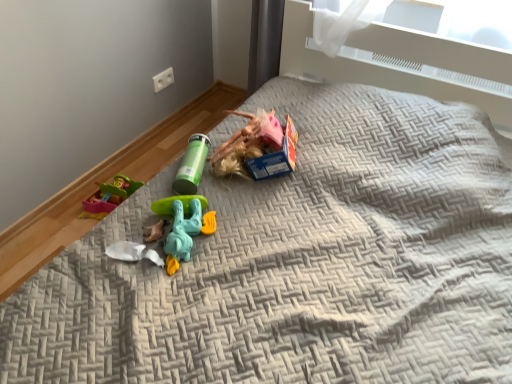
What is the approximate width of white plastic toy at center, acting as the second toy starting from the front?

2.19 inches.

This screenshot has width=512, height=384. Describe the element at coordinates (133, 252) in the screenshot. I see `white plastic toy at center, positioned as the 1th toy in bottom-to-top order` at that location.

Image resolution: width=512 pixels, height=384 pixels. I want to click on green plastic tube at center, marked as the first toy in a back-to-front arrangement, so click(192, 165).

Identify the location of teal plastic toy at center, positioned as the 1th toy in front-to-back order. (183, 226).

This screenshot has height=384, width=512. I want to click on toy below the teal plastic toy at center, positioned as the 1th toy in front-to-back order (from a real-world perspective), so click(133, 252).

From the image's perspective, between white plastic toy at center, marked as the 3th toy in a top-to-bottom arrangement, and teal plastic toy at center, which is the second toy from bottom to top, which one is located above?

teal plastic toy at center, which is the second toy from bottom to top, appears higher in the image.

Looking at this image, from a real-world perspective, relative to teal plastic toy at center, which is the second toy from bottom to top, is white plastic toy at center, marked as the 3th toy in a top-to-bottom arrangement, vertically above or below?

A: white plastic toy at center, marked as the 3th toy in a top-to-bottom arrangement, is situated lower than teal plastic toy at center, which is the second toy from bottom to top, in the real world.

Is white plastic toy at center, positioned as the 1th toy in bottom-to-top order, directly adjacent to teal plastic toy at center, positioned as the 1th toy in front-to-back order?

white plastic toy at center, positioned as the 1th toy in bottom-to-top order, is not next to teal plastic toy at center, positioned as the 1th toy in front-to-back order, and they're not touching.

From the picture: How different are the orientations of teal plastic toy at center, positioned as the 2th toy in top-to-bottom order, and white plastic toy at center, the second toy in the back-to-front sequence, in degrees?

18 degrees.

Is teal plastic toy at center, positioned as the 2th toy in top-to-bottom order, oriented towards white plastic toy at center, positioned as the 1th toy in bottom-to-top order?

No, teal plastic toy at center, positioned as the 2th toy in top-to-bottom order, is not turned towards white plastic toy at center, positioned as the 1th toy in bottom-to-top order.

Is teal plastic toy at center, which ranks as the third toy in back-to-front order, to the right of white plastic toy at center, marked as the 3th toy in a top-to-bottom arrangement, from the viewer's perspective?

Correct, you'll find teal plastic toy at center, which ranks as the third toy in back-to-front order, to the right of white plastic toy at center, marked as the 3th toy in a top-to-bottom arrangement.

Is teal plastic toy at center, which ranks as the third toy in back-to-front order, directly adjacent to white plastic toy at center, acting as the second toy starting from the front?

No.

In terms of width, does green plastic tube at center, which is counted as the third toy, starting from the front, look wider or thinner when compared to teal plastic toy at center, positioned as the 2th toy in top-to-bottom order?

In the image, green plastic tube at center, which is counted as the third toy, starting from the front, appears to be more narrow than teal plastic toy at center, positioned as the 2th toy in top-to-bottom order.

At what (x,y) coordinates should I click in order to perform the action: click on toy above the teal plastic toy at center, which ranks as the third toy in back-to-front order (from the image's perspective). Please return your answer as a coordinate pair (x, y). This screenshot has width=512, height=384. Looking at the image, I should click on (192, 165).

Consider the image. Could you tell me if green plastic tube at center, marked as the first toy in a back-to-front arrangement, is facing teal plastic toy at center, which ranks as the third toy in back-to-front order?

Yes, green plastic tube at center, marked as the first toy in a back-to-front arrangement, is facing teal plastic toy at center, which ranks as the third toy in back-to-front order.

Is the position of white plastic toy at center, acting as the second toy starting from the front, less distant than that of green plastic tube at center, which is counted as the third toy, starting from the front?

Yes, white plastic toy at center, acting as the second toy starting from the front, is in front of green plastic tube at center, which is counted as the third toy, starting from the front.

Is white plastic toy at center, marked as the 3th toy in a top-to-bottom arrangement, oriented towards green plastic tube at center, marked as the first toy in a back-to-front arrangement?

No, white plastic toy at center, marked as the 3th toy in a top-to-bottom arrangement, does not turn towards green plastic tube at center, marked as the first toy in a back-to-front arrangement.

What's the angular difference between white plastic toy at center, acting as the second toy starting from the front, and green plastic tube at center, marked as the first toy in a back-to-front arrangement,'s facing directions?

white plastic toy at center, acting as the second toy starting from the front, and green plastic tube at center, marked as the first toy in a back-to-front arrangement, are facing 0.63 degrees away from each other.

Based on their sizes in the image, would you say white plastic toy at center, positioned as the 1th toy in bottom-to-top order, is bigger or smaller than green plastic tube at center, marked as the first toy in a back-to-front arrangement?

Considering their sizes, white plastic toy at center, positioned as the 1th toy in bottom-to-top order, takes up less space than green plastic tube at center, marked as the first toy in a back-to-front arrangement.

In terms of size, does teal plastic toy at center, which is the second toy from bottom to top, appear bigger or smaller than green plastic tube at center, which is counted as the third toy, starting from the front?

In the image, teal plastic toy at center, which is the second toy from bottom to top, appears to be larger than green plastic tube at center, which is counted as the third toy, starting from the front.

Considering the sizes of objects teal plastic toy at center, which ranks as the third toy in back-to-front order, and green plastic tube at center, which is the third toy in bottom-to-top order, in the image provided, who is taller, teal plastic toy at center, which ranks as the third toy in back-to-front order, or green plastic tube at center, which is the third toy in bottom-to-top order,?

green plastic tube at center, which is the third toy in bottom-to-top order.

From the image's perspective, is teal plastic toy at center, positioned as the 1th toy in front-to-back order, located above or below green plastic tube at center, which is the third toy in bottom-to-top order?

From the image's perspective, teal plastic toy at center, positioned as the 1th toy in front-to-back order, appears below green plastic tube at center, which is the third toy in bottom-to-top order.

From the image's perspective, relative to white plastic toy at center, the second toy in the back-to-front sequence, is green plastic tube at center, which is counted as the third toy, starting from the front, above or below?

From the image's perspective, green plastic tube at center, which is counted as the third toy, starting from the front, appears above white plastic toy at center, the second toy in the back-to-front sequence.

From a real-world perspective, between green plastic tube at center, which is counted as the third toy, starting from the front, and white plastic toy at center, the second toy in the back-to-front sequence, who is vertically lower?

white plastic toy at center, the second toy in the back-to-front sequence.

Is green plastic tube at center, which appears as the 1th toy when viewed from the top, wider or thinner than white plastic toy at center, positioned as the 1th toy in bottom-to-top order?

green plastic tube at center, which appears as the 1th toy when viewed from the top, is wider than white plastic toy at center, positioned as the 1th toy in bottom-to-top order.

In the image, is green plastic tube at center, marked as the first toy in a back-to-front arrangement, positioned in front of or behind white plastic toy at center, marked as the 3th toy in a top-to-bottom arrangement?

Visually, green plastic tube at center, marked as the first toy in a back-to-front arrangement, is located behind white plastic toy at center, marked as the 3th toy in a top-to-bottom arrangement.

From the image's perspective, count 1st toys upward from the white plastic toy at center, the second toy in the back-to-front sequence, and point to it. Please provide its 2D coordinates.

[(183, 226)]

You are a GUI agent. You are given a task and a screenshot of the screen. Output one action in this format:
    pyautogui.click(x=<x>, y=<y>)
    Task: Click on the 1st toy directly above the white plastic toy at center, the second toy in the back-to-front sequence (from a real-world perspective)
    The width and height of the screenshot is (512, 384).
    Given the screenshot: What is the action you would take?
    pyautogui.click(x=183, y=226)

Considering their positions, is green plastic tube at center, which is counted as the third toy, starting from the front, positioned further to teal plastic toy at center, which ranks as the third toy in back-to-front order, than white plastic toy at center, the second toy in the back-to-front sequence?

Based on the image, green plastic tube at center, which is counted as the third toy, starting from the front, appears to be further to teal plastic toy at center, which ranks as the third toy in back-to-front order.

Based on their spatial positions, is teal plastic toy at center, which is the second toy from bottom to top, or green plastic tube at center, which appears as the 1th toy when viewed from the top, closer to white plastic toy at center, marked as the 3th toy in a top-to-bottom arrangement?

teal plastic toy at center, which is the second toy from bottom to top, lies closer to white plastic toy at center, marked as the 3th toy in a top-to-bottom arrangement, than the other object.

Estimate the real-world distances between objects in this image. Which object is closer to green plastic tube at center, marked as the first toy in a back-to-front arrangement, white plastic toy at center, marked as the 3th toy in a top-to-bottom arrangement, or teal plastic toy at center, positioned as the 2th toy in top-to-bottom order?

teal plastic toy at center, positioned as the 2th toy in top-to-bottom order.

Which object lies further to the anchor point white plastic toy at center, acting as the second toy starting from the front, green plastic tube at center, which appears as the 1th toy when viewed from the top, or teal plastic toy at center, positioned as the 1th toy in front-to-back order?

green plastic tube at center, which appears as the 1th toy when viewed from the top, is further to white plastic toy at center, acting as the second toy starting from the front.

Considering their positions, is teal plastic toy at center, which ranks as the third toy in back-to-front order, positioned closer to green plastic tube at center, which is the third toy in bottom-to-top order, than white plastic toy at center, acting as the second toy starting from the front?

Based on the image, teal plastic toy at center, which ranks as the third toy in back-to-front order, appears to be nearer to green plastic tube at center, which is the third toy in bottom-to-top order.

Looking at the image, which one is located further to teal plastic toy at center, which ranks as the third toy in back-to-front order, white plastic toy at center, the second toy in the back-to-front sequence, or green plastic tube at center, which is the third toy in bottom-to-top order?

The object further to teal plastic toy at center, which ranks as the third toy in back-to-front order, is green plastic tube at center, which is the third toy in bottom-to-top order.

At what (x,y) coordinates should I click in order to perform the action: click on toy that lies between green plastic tube at center, which appears as the 1th toy when viewed from the top, and white plastic toy at center, positioned as the 1th toy in bottom-to-top order, from top to bottom. Please return your answer as a coordinate pair (x, y). The width and height of the screenshot is (512, 384). Looking at the image, I should click on (183, 226).